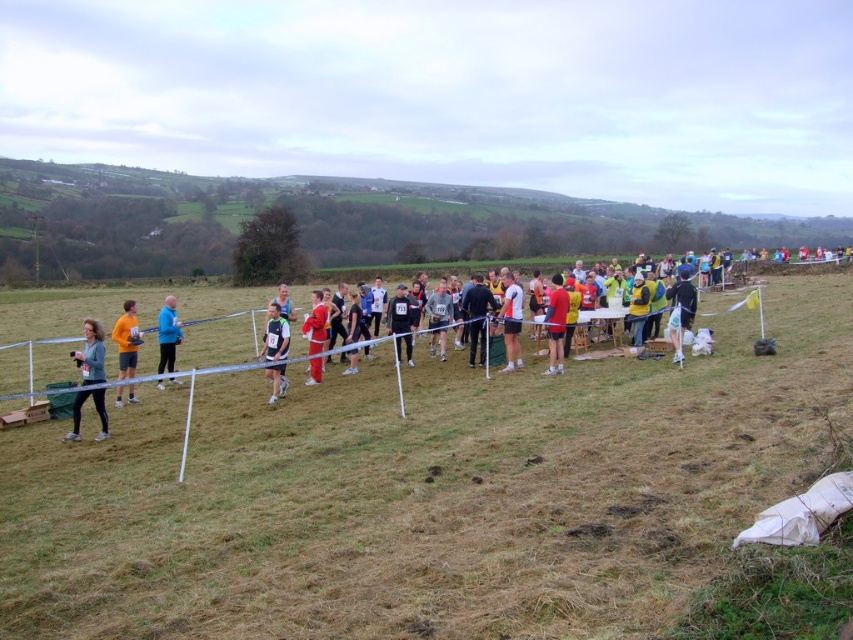
Question: Considering the real-world distances, which object is farthest from the matte white shirt at center?

Choices:
 (A) blue fabric jacket at center
 (B) white matte shirt at center
 (C) orange fleece jacket at left
 (D) matte gray jacket at left

Answer: (B)

Question: Does multicolored running group at center come behind matte white shirt at center?

Choices:
 (A) yes
 (B) no

Answer: (B)

Question: Which of the following is the closest to the observer?

Choices:
 (A) (550, 280)
 (B) (120, 401)

Answer: (B)

Question: Is multicolored running group at center to the right of matte gray jacket at left from the viewer's perspective?

Choices:
 (A) no
 (B) yes

Answer: (B)

Question: Among these points, which one is nearest to the camera?

Choices:
 (A) (550, 312)
 (B) (358, 592)
 (C) (96, 400)
 (D) (281, 396)

Answer: (B)

Question: Does red matte shirt at center have a larger size compared to red smooth pants at center?

Choices:
 (A) yes
 (B) no

Answer: (B)